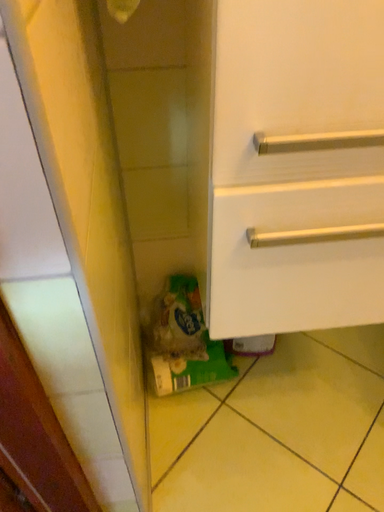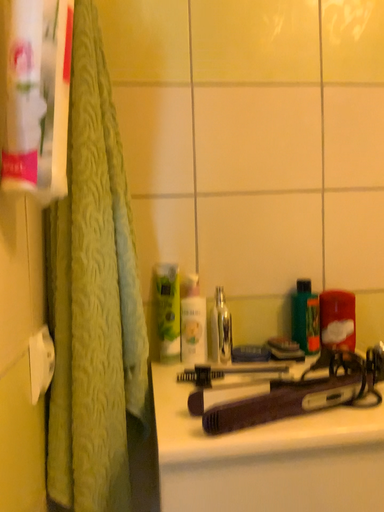
Question: How did the camera likely rotate when shooting the video?

Choices:
 (A) rotated downward
 (B) rotated upward

Answer: (B)